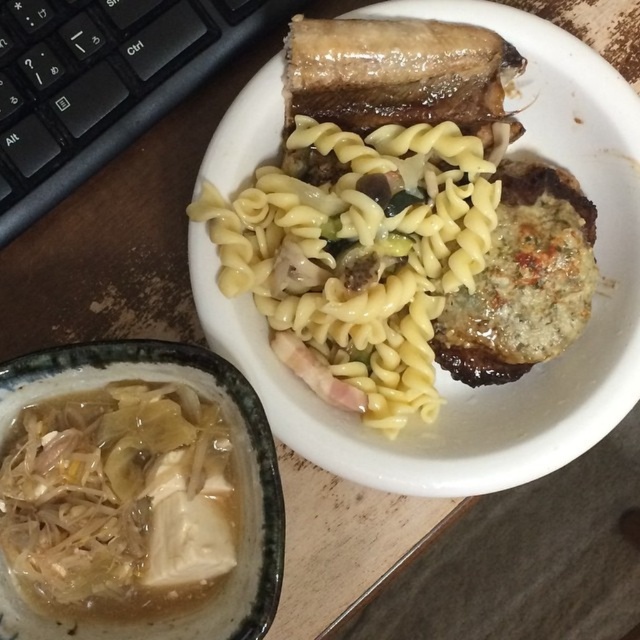
Who is taller, yellow matte pasta at upper center or translucent white broth at lower left?

With more height is yellow matte pasta at upper center.

From the picture: Can you confirm if yellow matte pasta at upper center is positioned above translucent white broth at lower left?

Indeed, yellow matte pasta at upper center is positioned over translucent white broth at lower left.

Measure the distance between yellow matte pasta at upper center and camera.

A distance of 29.46 inches exists between yellow matte pasta at upper center and camera.

At what (x,y) coordinates should I click in order to perform the action: click on yellow matte pasta at upper center. Please return your answer as a coordinate pair (x, y). Looking at the image, I should click on (442, 371).

Which is more to the right, yellow glossy pasta at center or translucent white broth at lower left?

yellow glossy pasta at center

Is yellow glossy pasta at center smaller than translucent white broth at lower left?

Actually, yellow glossy pasta at center might be larger than translucent white broth at lower left.

Does point (276, 259) lie behind point (118, 529)?

Yes, point (276, 259) is behind point (118, 529).

You are a GUI agent. You are given a task and a screenshot of the screen. Output one action in this format:
    pyautogui.click(x=<x>, y=<y>)
    Task: Click on the yellow glossy pasta at center
    The height and width of the screenshot is (640, 640).
    Given the screenshot: What is the action you would take?
    pyautogui.click(x=360, y=257)

How much distance is there between yellow matte pasta at upper center and yellow glossy pasta at center?

yellow matte pasta at upper center and yellow glossy pasta at center are 3.34 inches apart.

Can you confirm if yellow matte pasta at upper center is positioned below yellow glossy pasta at center?

No.

Is point (547, 93) positioned after point (292, 209)?

Yes, point (547, 93) is farther from viewer.

This screenshot has height=640, width=640. I want to click on yellow matte pasta at upper center, so click(442, 371).